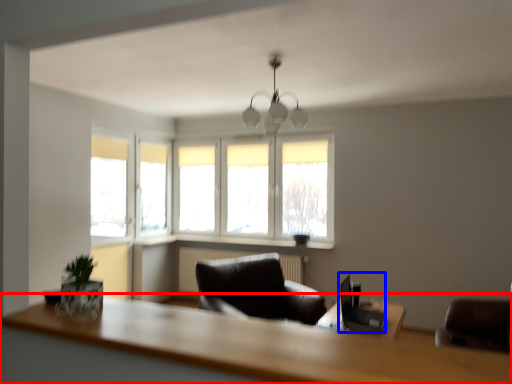
Question: Which point is further to the camera, table (highlighted by a red box) or computer desk (highlighted by a blue box)?

Choices:
 (A) table
 (B) computer desk

Answer: (B)